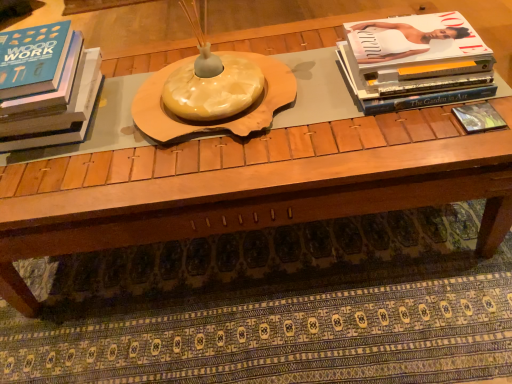
You are a GUI agent. You are given a task and a screenshot of the screen. Output one action in this format:
    pyautogui.click(x=<x>, y=<y>)
    Task: Click on the vacant space that is to the left of matte white book at upper right, the 2th book when ordered from right to left
    
    Given the screenshot: What is the action you would take?
    pyautogui.click(x=308, y=97)